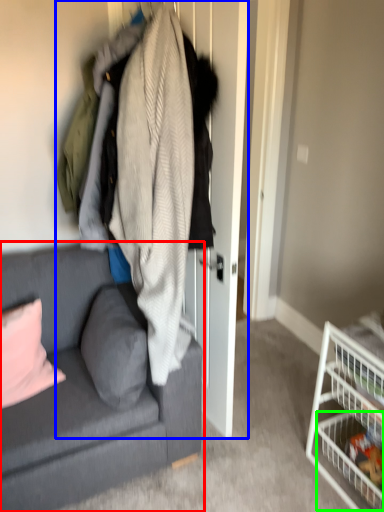
Question: Based on their relative distances, which object is nearer to studio couch (highlighted by a red box)? Choose from closet (highlighted by a blue box) and shelf (highlighted by a green box).

Choices:
 (A) closet
 (B) shelf

Answer: (A)